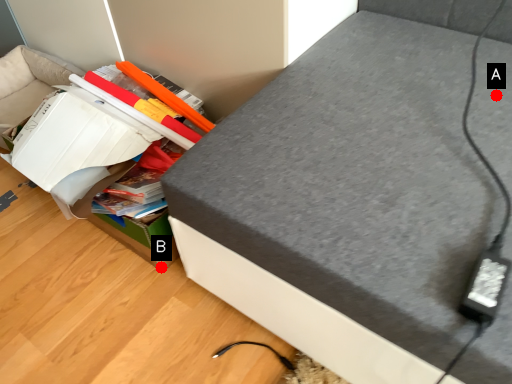
Question: Two points are circled on the image, labeled by A and B beside each circle. Among these points, which one is farthest from the camera?

Choices:
 (A) A is further
 (B) B is further

Answer: (B)